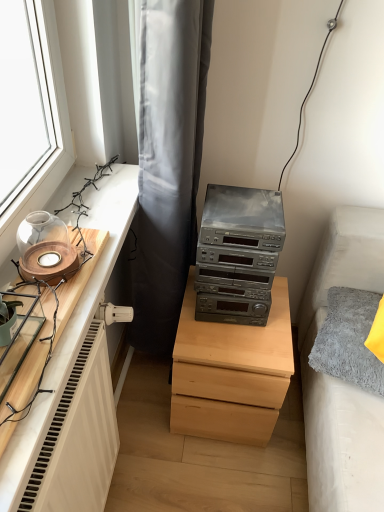
You are a GUI agent. You are given a task and a screenshot of the screen. Output one action in this format:
    pyautogui.click(x=<x>, y=<y>)
    Task: Click on the wooden candle holder at left
    Image resolution: width=384 pixels, height=512 pixels.
    Given the screenshot: What is the action you would take?
    pyautogui.click(x=45, y=248)

The width and height of the screenshot is (384, 512). Describe the element at coordinates (168, 162) in the screenshot. I see `gray fabric curtain at upper center` at that location.

The height and width of the screenshot is (512, 384). What are the coordinates of `metallic gray stereo at center` in the screenshot? It's located at (238, 254).

Considering the relative sizes of gray fluffy pillow at right and wooden tray at left in the image provided, is gray fluffy pillow at right bigger than wooden tray at left?

Yes, gray fluffy pillow at right is bigger than wooden tray at left.

Identify the location of pillow that is behind the wooden tray at left. (349, 340).

What's the angular difference between gray fluffy pillow at right and wooden tray at left's facing directions?

gray fluffy pillow at right and wooden tray at left are facing 17.2 degrees away from each other.

Based on the photo, considering the positions of objects gray fluffy pillow at right and wooden tray at left in the image provided, who is more to the left, gray fluffy pillow at right or wooden tray at left?

wooden tray at left.

From the image's perspective, relative to gray fluffy pillow at right, is light wood chest of drawers at center above or below?

light wood chest of drawers at center is below gray fluffy pillow at right.

From their relative heights in the image, would you say light wood chest of drawers at center is taller or shorter than gray fluffy pillow at right?

Clearly, light wood chest of drawers at center is taller compared to gray fluffy pillow at right.

Can you confirm if light wood chest of drawers at center is positioned to the right of gray fluffy pillow at right?

Incorrect, light wood chest of drawers at center is not on the right side of gray fluffy pillow at right.

Where is `pillow above the light wood chest of drawers at center (from a real-world perspective)`? This screenshot has width=384, height=512. pillow above the light wood chest of drawers at center (from a real-world perspective) is located at coordinates (349, 340).

From a real-world perspective, is wooden candle holder at left above or below metallic gray stereo at center?

In terms of real-world spatial position, wooden candle holder at left is above metallic gray stereo at center.

In the image, is wooden candle holder at left on the left side or the right side of metallic gray stereo at center?

In the image, wooden candle holder at left appears on the left side of metallic gray stereo at center.

Between point (36, 234) and point (232, 225), which one is positioned in front?

Positioned in front is point (36, 234).

Is metallic gray stereo at center at the back of wooden candle holder at left?

wooden candle holder at left is not turned away from metallic gray stereo at center.

Would you say light wood chest of drawers at center contains metallic gray stereo at center?

That's incorrect, metallic gray stereo at center is not inside light wood chest of drawers at center.

From the image's perspective, is light wood chest of drawers at center below metallic gray stereo at center?

Yes, from the image's perspective, light wood chest of drawers at center is beneath metallic gray stereo at center.

Locate an element on the screen. the chest of drawers below the metallic gray stereo at center (from the image's perspective) is located at coordinates (231, 372).

Is wooden tray at left in contact with light wood chest of drawers at center?

No, wooden tray at left is not touching light wood chest of drawers at center.

Is wooden tray at left wider than light wood chest of drawers at center?

Incorrect, the width of wooden tray at left does not surpass that of light wood chest of drawers at center.

Identify the location of entertainment center on the left of light wood chest of drawers at center. coord(72,327).

Is light wood chest of drawers at center inside wooden tray at left?

No, light wood chest of drawers at center is not surrounded by wooden tray at left.

Is the position of gray fluffy pillow at right less distant than that of gray fabric curtain at upper center?

No, it is behind gray fabric curtain at upper center.

From the image's perspective, is gray fluffy pillow at right below gray fabric curtain at upper center?

Yes, from the image's perspective, gray fluffy pillow at right is below gray fabric curtain at upper center.

Is gray fluffy pillow at right directly adjacent to gray fabric curtain at upper center?

No.

Is gray fluffy pillow at right taller than gray fabric curtain at upper center?

Incorrect, the height of gray fluffy pillow at right is not larger of that of gray fabric curtain at upper center.

Is gray fluffy pillow at right not near metallic gray stereo at center?

No, gray fluffy pillow at right is in close proximity to metallic gray stereo at center.

Is gray fluffy pillow at right turned away from metallic gray stereo at center?

gray fluffy pillow at right is not turned away from metallic gray stereo at center.

Which is behind, point (343, 304) or point (242, 212)?

The point (343, 304) is farther.

From the image's perspective, between gray fluffy pillow at right and metallic gray stereo at center, which one is located above?

From the image's view, metallic gray stereo at center is above.

In the image, there is a gray fluffy pillow at right. At what (x,y) coordinates should I click in order to perform the action: click on entertainment center above it (from the image's perspective). Please return your answer as a coordinate pair (x, y). Looking at the image, I should click on (72, 327).

Find the location of a particular element. Image resolution: width=384 pixels, height=512 pixels. the chest of drawers behind the gray fluffy pillow at right is located at coordinates (231, 372).

From the image, which object appears to be farther from light wood chest of drawers at center, metallic gray stereo at center or gray fluffy pillow at right?

gray fluffy pillow at right is further to light wood chest of drawers at center.

Estimate the real-world distances between objects in this image. Which object is closer to wooden tray at left, light wood chest of drawers at center or metallic gray stereo at center?

Among the two, metallic gray stereo at center is located nearer to wooden tray at left.

Considering their positions, is gray fluffy pillow at right positioned further to light wood chest of drawers at center than wooden candle holder at left?

Among the two, wooden candle holder at left is located further to light wood chest of drawers at center.

Estimate the real-world distances between objects in this image. Which object is further from gray fabric curtain at upper center, light wood chest of drawers at center or wooden tray at left?

light wood chest of drawers at center is further to gray fabric curtain at upper center.

Considering their positions, is wooden tray at left positioned further to metallic gray stereo at center than gray fluffy pillow at right?

wooden tray at left.

From the image, which object appears to be nearer to gray fabric curtain at upper center, light wood chest of drawers at center or gray fluffy pillow at right?

light wood chest of drawers at center is closer to gray fabric curtain at upper center.

Looking at the image, which one is located further to metallic gray stereo at center, wooden tray at left or gray fabric curtain at upper center?

Based on the image, wooden tray at left appears to be further to metallic gray stereo at center.

Considering their positions, is wooden candle holder at left positioned further to gray fabric curtain at upper center than wooden tray at left?

wooden candle holder at left lies further to gray fabric curtain at upper center than the other object.

The height and width of the screenshot is (512, 384). Identify the location of curtain between wooden candle holder at left and gray fluffy pillow at right in the horizontal direction. (168, 162).

Find the location of a particular element. This screenshot has height=512, width=384. stereo between wooden tray at left and light wood chest of drawers at center along the z-axis is located at coordinates (238, 254).

I want to click on candle holder between wooden tray at left and metallic gray stereo at center from left to right, so click(45, 248).

Find the location of `stereo between light wood chest of drawers at center and gray fluffy pillow at right`. stereo between light wood chest of drawers at center and gray fluffy pillow at right is located at coordinates (238, 254).